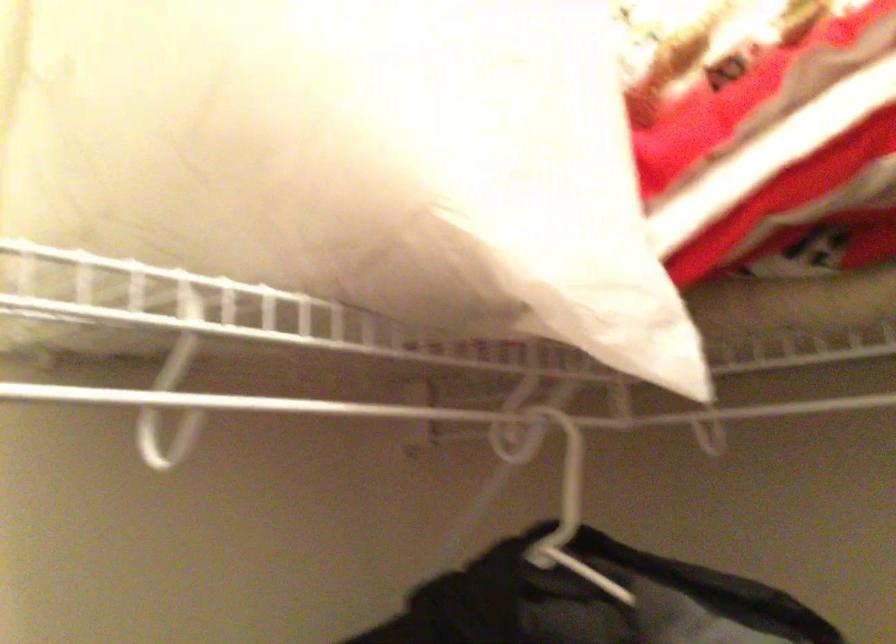
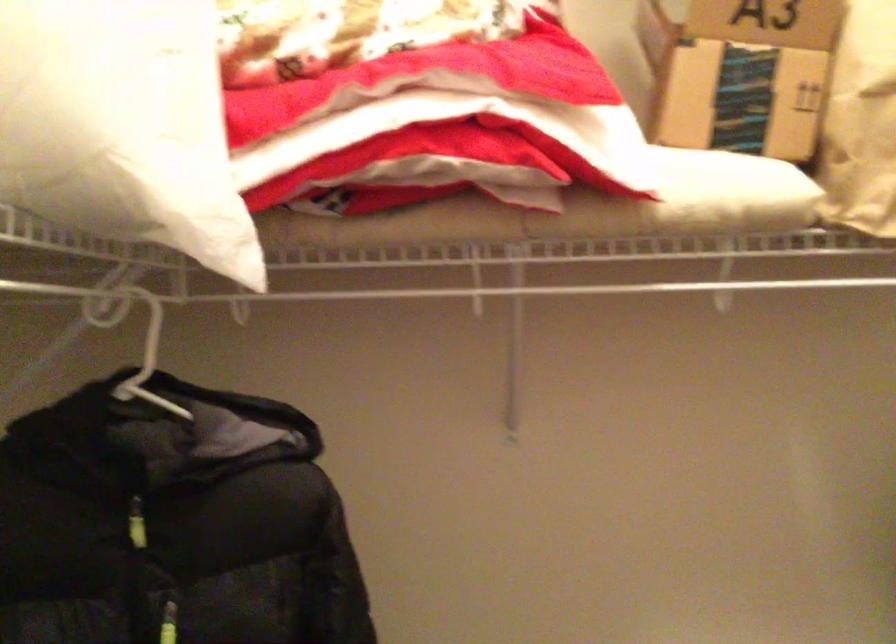
In the second image, find the point that corresponds to (452,171) in the first image.

(123, 126)